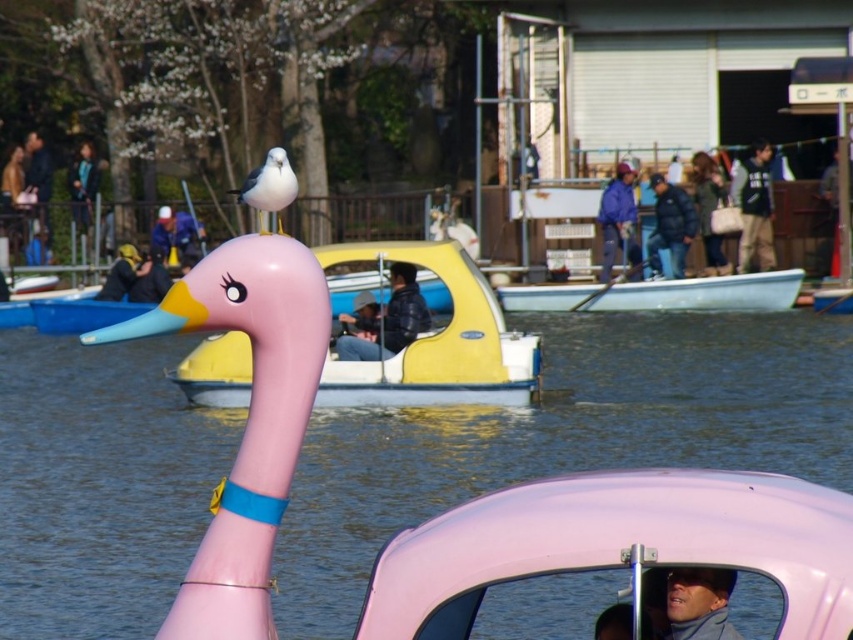
You are standing at the point with coordinates point (360, 349) and want to move towards the point with coordinates point (772, 504). Which direction should you move in relation to the pink swan boat?

Point (772, 504) is in front of point (360, 349), so you should move forward towards the pink swan boat.

You are standing on the dock and see the pink matte plastic boat at center and the leather jacket at center. Which object is farther away from you?

The pink matte plastic boat at center is 29.06 meters away from the leather jacket at center, so the pink matte plastic boat at center is farther away from you.